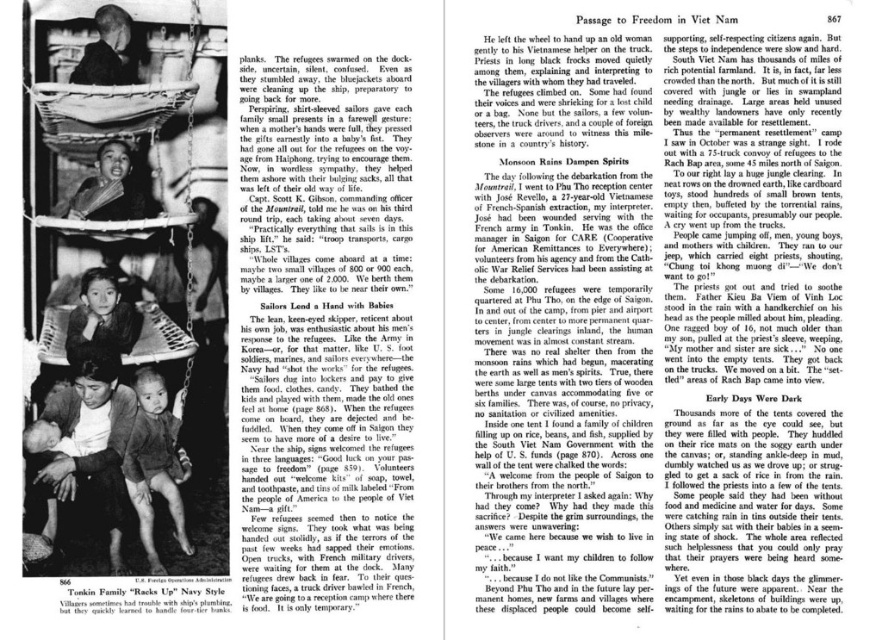
This screenshot has height=640, width=882. What do you see at coordinates (147, 598) in the screenshot?
I see `brushed metal water at bottle left` at bounding box center [147, 598].

Which is more to the right, brushed metal water at bottle left or matte black baby at center?

From the viewer's perspective, brushed metal water at bottle left appears more on the right side.

Does point (71, 596) come in front of point (146, 204)?

Yes.

I want to click on brushed metal water at bottle left, so click(147, 598).

Is matte black laptop at center shorter than light brown skin at center?

Incorrect, matte black laptop at center's height does not fall short of light brown skin at center's.

Can you confirm if matte black laptop at center is wider than light brown skin at center?

Yes.

Does point (275, 488) come in front of point (157, 406)?

That is True.

The width and height of the screenshot is (882, 640). In order to click on matte black laptop at center in this screenshot , I will do pyautogui.click(x=325, y=332).

Can you confirm if matte brown fabric baby at center is thinner than matte black helmet at upper left?

No.

Is point (96, 435) closer to viewer compared to point (103, 13)?

Yes, it is.

What are the coordinates of `matte brown fabric baby at center` in the screenshot? It's located at (88, 442).